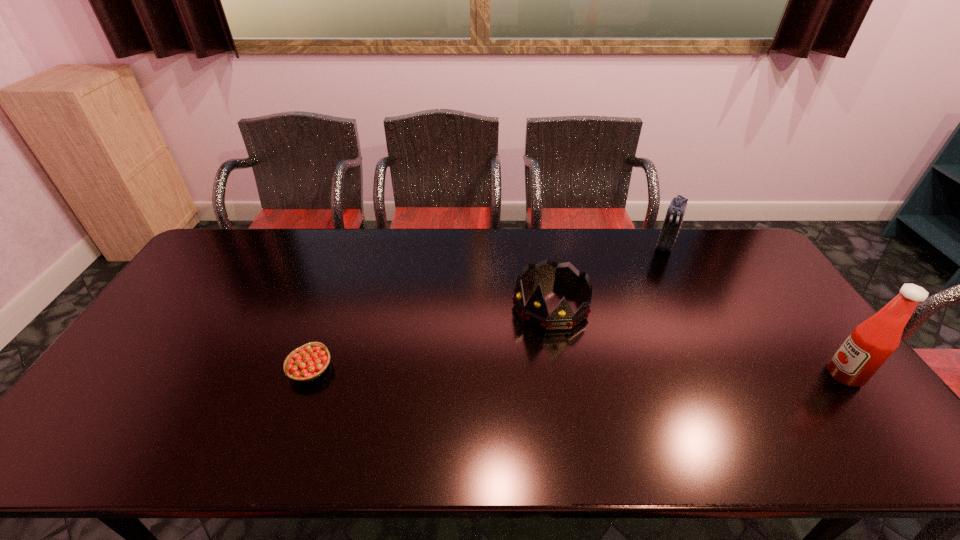
You are a GUI agent. You are given a task and a screenshot of the screen. Output one action in this format:
    pyautogui.click(x=<x>, y=<y>)
    Task: Click on the free space on the desktop that is between the strawberry and the tallest object and is positioned with the zip open on the farthest object
    This screenshot has width=960, height=540.
    Given the screenshot: What is the action you would take?
    pyautogui.click(x=612, y=372)

I want to click on free space on the desktop that is between the strawberry and the rightmost object and is positioned at the front of the tiara with jewels, so click(x=503, y=371).